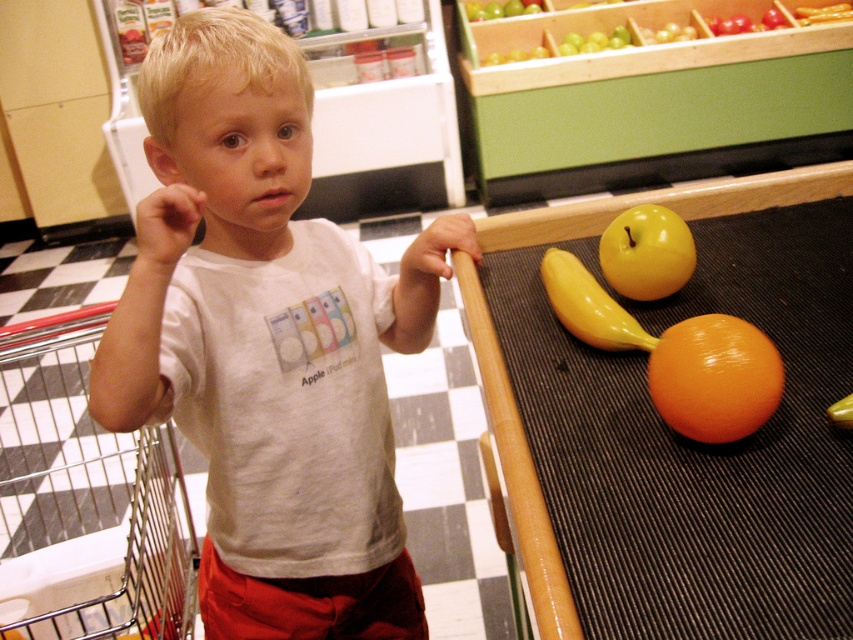
You are standing at the point labeled as point (346, 260) in the image. If you want to reach the conveyor belt with the oversized fruits, which direction should you move relative to your current position?

Since the point (346, 260) is 1.04 meters away from the viewer, you should move towards the conveyor belt located on the right side of the image to reach it.

From the picture: You are a delivery robot navigating through the grocery store scene. You need to move from point A at point [650,232] to point B at point [590,344]. Considering the spatial relationship between these points, will you have to move closer to or further away from the viewer to reach your destination?

To move from point A at point [650,232] to point B at point [590,344], you will have to move further away from the viewer because point A is closer to the viewer than point B.

You are a parent trying to grab the glossy orange at lower right and the yellow rubber banana at center from the conveyor belt. Which fruit should you grab first to reach the one closer to you?

The glossy orange at lower right is closer to you, so you should grab it first.